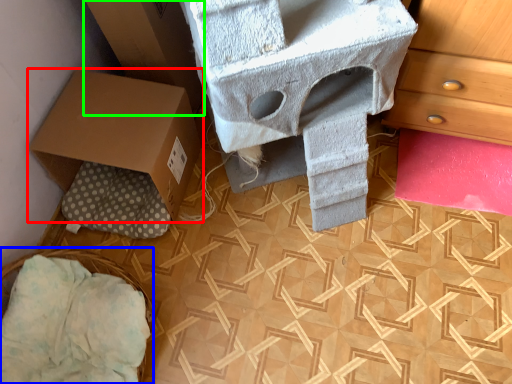
Question: Which is nearer to the box (highlighted by a red box)? basket (highlighted by a blue box) or cardboard box (highlighted by a green box).

Choices:
 (A) basket
 (B) cardboard box

Answer: (B)